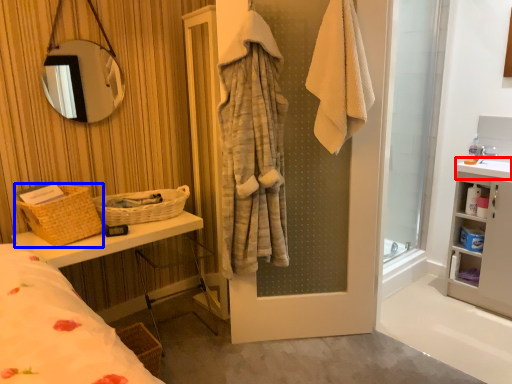
Question: Which object is further to the camera taking this photo, counter top (highlighted by a red box) or basket (highlighted by a blue box)?

Choices:
 (A) counter top
 (B) basket

Answer: (A)